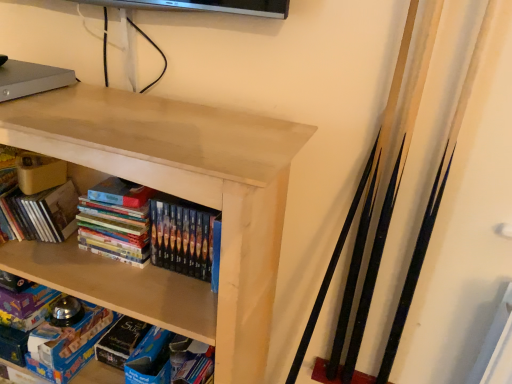
Question: Could you tell me if blue matte board game at lower left is turned towards matte cardboard book at upper left, which appears as the 2th book when viewed from the right?

Choices:
 (A) no
 (B) yes

Answer: (A)

Question: Is blue matte board game at lower left positioned in front of matte cardboard book at upper left, which is the first book in left-to-right order?

Choices:
 (A) no
 (B) yes

Answer: (A)

Question: Can you confirm if blue matte board game at lower left is shorter than matte cardboard book at upper left, which appears as the 2th book when viewed from the right?

Choices:
 (A) no
 (B) yes

Answer: (B)

Question: From the image's perspective, is blue matte board game at lower left beneath matte cardboard book at upper left, which appears as the 2th book when viewed from the right?

Choices:
 (A) no
 (B) yes

Answer: (B)

Question: Is blue matte board game at lower left at the right side of matte cardboard book at upper left, which is the first book in left-to-right order?

Choices:
 (A) no
 (B) yes

Answer: (B)

Question: Is blue matte board game at lower left placed right next to matte cardboard book at upper left, which is the first book in left-to-right order?

Choices:
 (A) yes
 (B) no

Answer: (B)

Question: Can we say matte wood shelf at upper center lies outside blue matte board game at lower left?

Choices:
 (A) yes
 (B) no

Answer: (A)

Question: Can you confirm if matte wood shelf at upper center is positioned to the left of blue matte board game at lower left?

Choices:
 (A) yes
 (B) no

Answer: (B)

Question: Can you confirm if matte wood shelf at upper center is wider than blue matte board game at lower left?

Choices:
 (A) no
 (B) yes

Answer: (B)

Question: Considering the relative sizes of matte wood shelf at upper center and blue matte board game at lower left in the image provided, is matte wood shelf at upper center thinner than blue matte board game at lower left?

Choices:
 (A) yes
 (B) no

Answer: (B)

Question: From the image's perspective, is matte wood shelf at upper center under blue matte board game at lower left?

Choices:
 (A) yes
 (B) no

Answer: (B)

Question: Is matte wood shelf at upper center closer to camera compared to blue matte board game at lower left?

Choices:
 (A) no
 (B) yes

Answer: (B)

Question: Is matte cardboard book at upper left, which appears as the 2th book when viewed from the right, smaller than blue matte board game at lower left?

Choices:
 (A) no
 (B) yes

Answer: (A)